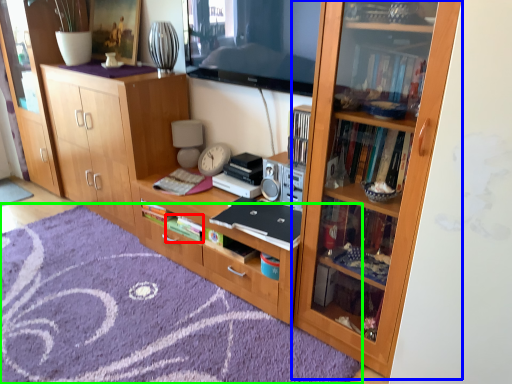
Question: Based on their relative distances, which object is nearer to book (highlighted by a red box)? Choose from bookcase (highlighted by a blue box) and doormat (highlighted by a green box).

Choices:
 (A) bookcase
 (B) doormat

Answer: (B)